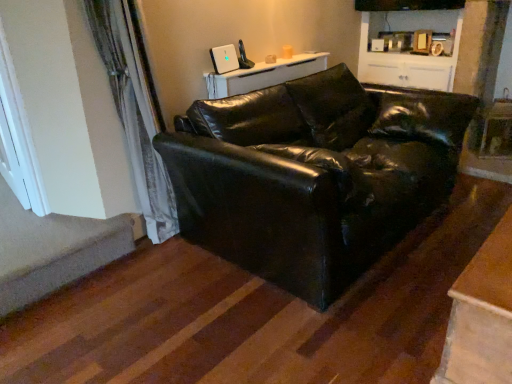
At what (x,y) coordinates should I click in order to perform the action: click on white painted wood window at left. Please return your answer as a coordinate pair (x, y). Looking at the image, I should click on (21, 129).

What do you see at coordinates (21, 129) in the screenshot? This screenshot has width=512, height=384. I see `white painted wood window at left` at bounding box center [21, 129].

Image resolution: width=512 pixels, height=384 pixels. Describe the element at coordinates (54, 249) in the screenshot. I see `carpeted stairwell at lower left` at that location.

The width and height of the screenshot is (512, 384). Find the location of `white glossy table at upper center, which is counted as the first table, starting from the back`. white glossy table at upper center, which is counted as the first table, starting from the back is located at coordinates (264, 75).

This screenshot has height=384, width=512. I want to click on wooden table at lower right, which is the first table in front-to-back order, so click(481, 316).

This screenshot has height=384, width=512. What do you see at coordinates (411, 47) in the screenshot?
I see `white glossy cabinet at upper center` at bounding box center [411, 47].

Where is `white painted wood window at left`? white painted wood window at left is located at coordinates (21, 129).

Considering the sizes of objects velvet curtain at left and black leather couch at center in the image provided, who is taller, velvet curtain at left or black leather couch at center?

With more height is velvet curtain at left.

Is velvet curtain at left far away from black leather couch at center?

Actually, velvet curtain at left and black leather couch at center are a little close together.

From a real-world perspective, which is physically above, velvet curtain at left or black leather couch at center?

velvet curtain at left, from a real-world perspective.

Measure the distance from velvet curtain at left to black leather couch at center.

velvet curtain at left and black leather couch at center are 87.65 centimeters apart from each other.

Does point (488, 270) appear closer or farther from the camera than point (42, 232)?

Point (488, 270).

Is wooden table at lower right, which ranks as the 1th table in right-to-left order, spatially inside carpeted stairwell at lower left, or outside of it?

wooden table at lower right, which ranks as the 1th table in right-to-left order, exists outside the volume of carpeted stairwell at lower left.

From a real-world perspective, starting from the carpeted stairwell at lower left, which table is the 1st one vertically above it? Please provide its 2D coordinates.

[(481, 316)]

What's the angular difference between wooden table at lower right, positioned as the 2th table in top-to-bottom order, and carpeted stairwell at lower left's facing directions?

The facing directions of wooden table at lower right, positioned as the 2th table in top-to-bottom order, and carpeted stairwell at lower left are 179 degrees apart.

Is white glossy table at upper center, the 1th table when ordered from left to right, inside or outside of carpeted stairwell at lower left?

white glossy table at upper center, the 1th table when ordered from left to right, is located beyond the bounds of carpeted stairwell at lower left.

This screenshot has width=512, height=384. Find the location of `stairwell below the white glossy table at upper center, positioned as the 2th table in bottom-to-top order (from a real-world perspective)`. stairwell below the white glossy table at upper center, positioned as the 2th table in bottom-to-top order (from a real-world perspective) is located at coordinates (54, 249).

From the image's perspective, who appears lower, white glossy table at upper center, positioned as the 2th table in bottom-to-top order, or carpeted stairwell at lower left?

carpeted stairwell at lower left, from the image's perspective.

Is white glossy table at upper center, which is the first table from top to bottom, smaller than carpeted stairwell at lower left?

Yes.

Would you say white glossy cabinet at upper center is inside or outside carpeted stairwell at lower left?

white glossy cabinet at upper center lies outside carpeted stairwell at lower left.

How many degrees apart are the facing directions of white glossy cabinet at upper center and carpeted stairwell at lower left?

They differ by 88.9 degrees in their facing directions.

Is white glossy cabinet at upper center turned away from carpeted stairwell at lower left?

No.

Which is closer, (x=366, y=50) or (x=23, y=304)?

The point (x=23, y=304) is closer.

Does white painted wood window at left turn towards carpeted stairwell at lower left?

No.

Is point (25, 160) closer to viewer compared to point (4, 287)?

No, it is behind (4, 287).

Considering the relative positions of white painted wood window at left and carpeted stairwell at lower left in the image provided, is white painted wood window at left to the right of carpeted stairwell at lower left from the viewer's perspective?

No.

Considering the sizes of objects white painted wood window at left and carpeted stairwell at lower left in the image provided, who is taller, white painted wood window at left or carpeted stairwell at lower left?

Standing taller between the two is white painted wood window at left.

Would you consider white painted wood window at left to be distant from white glossy cabinet at upper center?

Absolutely, white painted wood window at left is distant from white glossy cabinet at upper center.

Find the location of a particular element. window lying below the white glossy cabinet at upper center (from the image's perspective) is located at coordinates (21, 129).

Is white painted wood window at left positioned before white glossy cabinet at upper center?

Yes, white painted wood window at left is in front of white glossy cabinet at upper center.

Is white painted wood window at left facing towards white glossy cabinet at upper center?

No, white painted wood window at left is not aimed at white glossy cabinet at upper center.

Is carpeted stairwell at lower left inside the boundaries of wooden table at lower right, which is counted as the 2th table, starting from the back, or outside?

carpeted stairwell at lower left exists outside the volume of wooden table at lower right, which is counted as the 2th table, starting from the back.

How much distance is there between carpeted stairwell at lower left and wooden table at lower right, marked as the second table in a left-to-right arrangement?

A distance of 1.88 meters exists between carpeted stairwell at lower left and wooden table at lower right, marked as the second table in a left-to-right arrangement.

Does carpeted stairwell at lower left have a greater height compared to wooden table at lower right, which is counted as the 2th table, starting from the back?

In fact, carpeted stairwell at lower left may be shorter than wooden table at lower right, which is counted as the 2th table, starting from the back.

Considering the sizes of objects carpeted stairwell at lower left and wooden table at lower right, which is counted as the 2th table, starting from the back, in the image provided, who is smaller, carpeted stairwell at lower left or wooden table at lower right, which is counted as the 2th table, starting from the back,?

Smaller between the two is carpeted stairwell at lower left.

Where is `studio couch beneath the velvet curtain at left (from a real-world perspective)`? This screenshot has width=512, height=384. studio couch beneath the velvet curtain at left (from a real-world perspective) is located at coordinates (313, 175).

Identify the location of table lying in front of the carpeted stairwell at lower left. (481, 316).

Considering their positions, is wooden table at lower right, which is counted as the 2th table, starting from the back, positioned further to white glossy cabinet at upper center than carpeted stairwell at lower left?

carpeted stairwell at lower left.

Looking at the image, which one is located closer to velvet curtain at left, white glossy cabinet at upper center or white glossy table at upper center, which is counted as the first table, starting from the back?

The object closer to velvet curtain at left is white glossy table at upper center, which is counted as the first table, starting from the back.

Looking at the image, which one is located closer to carpeted stairwell at lower left, white painted wood window at left or white glossy cabinet at upper center?

The object closer to carpeted stairwell at lower left is white painted wood window at left.

Considering their positions, is white glossy cabinet at upper center positioned further to white painted wood window at left than velvet curtain at left?

white glossy cabinet at upper center lies further to white painted wood window at left than the other object.

From the image, which object appears to be farther from black leather couch at center, carpeted stairwell at lower left or velvet curtain at left?

carpeted stairwell at lower left is positioned further to the anchor black leather couch at center.

Based on their spatial positions, is wooden table at lower right, marked as the second table in a left-to-right arrangement, or white glossy table at upper center, which is the second table in right-to-left order, closer to white painted wood window at left?

Based on the image, white glossy table at upper center, which is the second table in right-to-left order, appears to be nearer to white painted wood window at left.

Which object lies further to the anchor point white painted wood window at left, velvet curtain at left or black leather couch at center?

Based on the image, black leather couch at center appears to be further to white painted wood window at left.

Looking at the image, which one is located closer to velvet curtain at left, carpeted stairwell at lower left or white glossy cabinet at upper center?

The object closer to velvet curtain at left is carpeted stairwell at lower left.

The height and width of the screenshot is (384, 512). I want to click on studio couch situated between white painted wood window at left and wooden table at lower right, which is counted as the 2th table, starting from the back, from left to right, so click(x=313, y=175).

Where is `table between black leather couch at center and white glossy cabinet at upper center in the front-back direction`? This screenshot has height=384, width=512. table between black leather couch at center and white glossy cabinet at upper center in the front-back direction is located at coordinates (264, 75).

Image resolution: width=512 pixels, height=384 pixels. Identify the location of table between carpeted stairwell at lower left and black leather couch at center. (264, 75).

Locate an element on the screen. This screenshot has width=512, height=384. curtain that lies between white glossy table at upper center, which is counted as the first table, starting from the back, and carpeted stairwell at lower left from top to bottom is located at coordinates (134, 115).